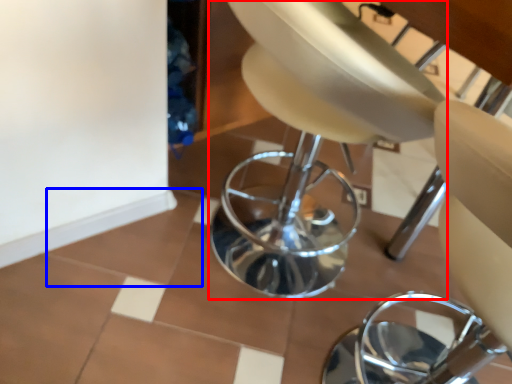
Question: Among these objects, which one is farthest to the camera, swivel chair (highlighted by a red box) or ceramic tile (highlighted by a blue box)?

Choices:
 (A) swivel chair
 (B) ceramic tile

Answer: (B)